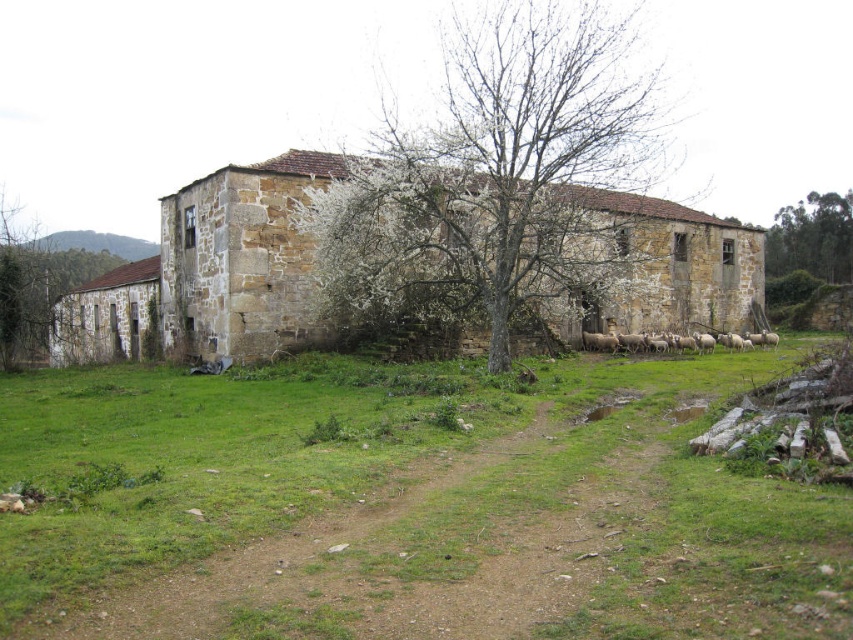
Does bare wood tree at center have a smaller size compared to green leafy tree at upper right?

No.

Is point (22, 264) closer to camera compared to point (770, 253)?

Yes, point (22, 264) is closer to viewer.

I want to click on bare wood tree at center, so click(x=36, y=289).

Between bare branches at center and green leafy tree at upper right, which one is positioned higher?

Positioned higher is bare branches at center.

Describe the element at coordinates (494, 176) in the screenshot. This screenshot has height=640, width=853. I see `bare branches at center` at that location.

Where is `bare branches at center`? Image resolution: width=853 pixels, height=640 pixels. bare branches at center is located at coordinates (494, 176).

Who is higher up, green grass at center or bare branches at center?

bare branches at center

Does point (326, 456) lie behind point (546, 227)?

No, (326, 456) is in front of (546, 227).

Who is more forward, [440,557] or [465,132]?

Positioned in front is point [440,557].

The image size is (853, 640). I want to click on green grass at center, so click(x=410, y=508).